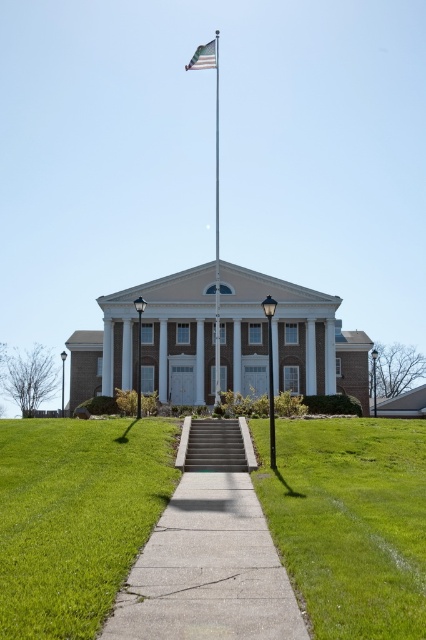
You are a visitor approaching the grand neoclassical building and see the green concrete stairs at center and the american flag at upper center. Which object is closer to you as you approach the building from the pathway?

The green concrete stairs at center is closer to you because it is in front of the american flag at upper center, meaning the stairs are positioned between you and the flag as you approach the building.

You are standing at the entrance of the grand neoclassical building and want to walk directly towards the center of the concrete at center. What direction should you move in relative to the building?

Since the concrete at center is positioned at point coordinates, you should move straight ahead towards the center of the concrete at center as it is directly in front of the building.

You are a visitor approaching the grand building and notice the green concrete stairs at center and the american flag at upper center. Which object appears larger in the scene?

The american flag at upper center appears larger than the green concrete stairs at center in the scene.